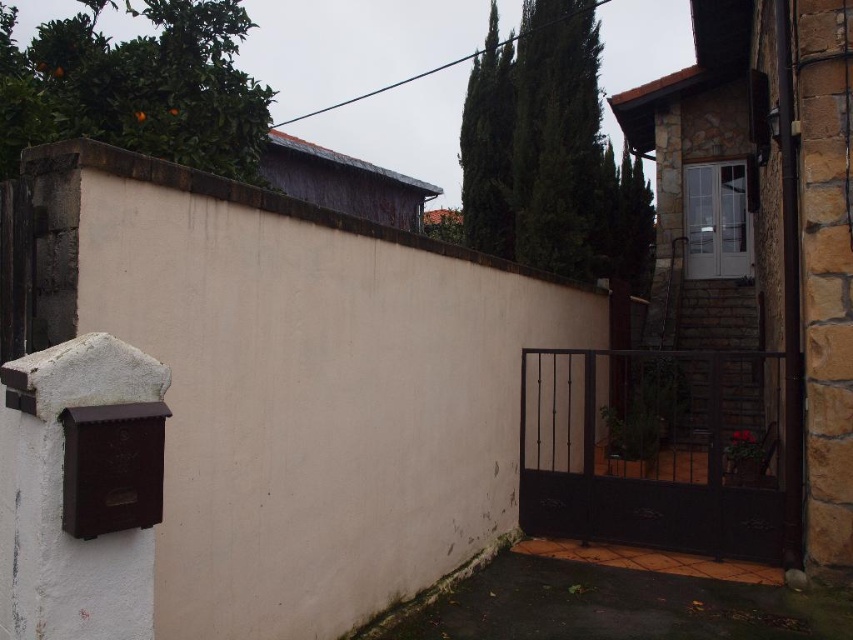
Which is above, green leafy cypress tree at upper center or green leafy cypress at upper left?

green leafy cypress at upper left is above.

Does green leafy cypress tree at upper center have a greater width compared to green leafy cypress at upper left?

No.

The image size is (853, 640). In order to click on green leafy cypress tree at upper center in this screenshot , I will do `click(548, 152)`.

You are a GUI agent. You are given a task and a screenshot of the screen. Output one action in this format:
    pyautogui.click(x=<x>, y=<y>)
    Task: Click on the green leafy cypress tree at upper center
    The image size is (853, 640).
    Given the screenshot: What is the action you would take?
    pyautogui.click(x=548, y=152)